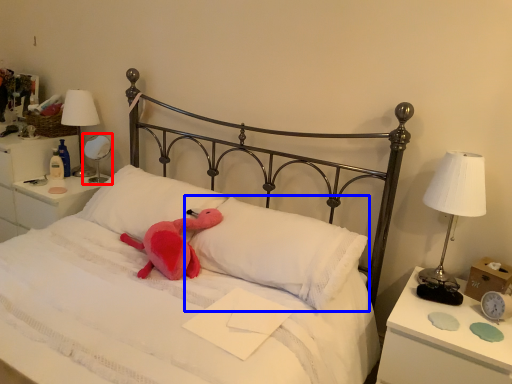
Question: Which object appears closest to the camera in this image, bedside lamp (highlighted by a red box) or pillow (highlighted by a blue box)?

Choices:
 (A) bedside lamp
 (B) pillow

Answer: (B)